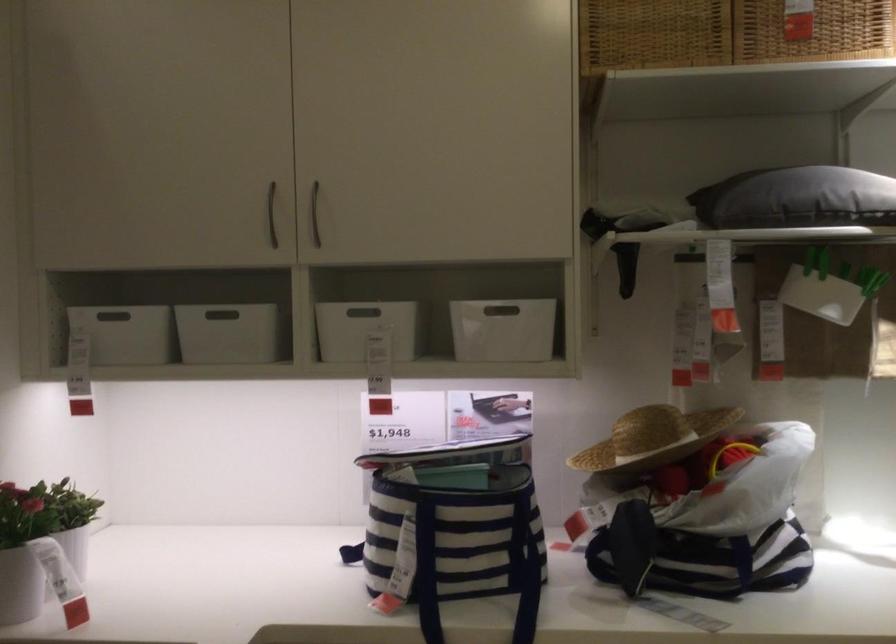
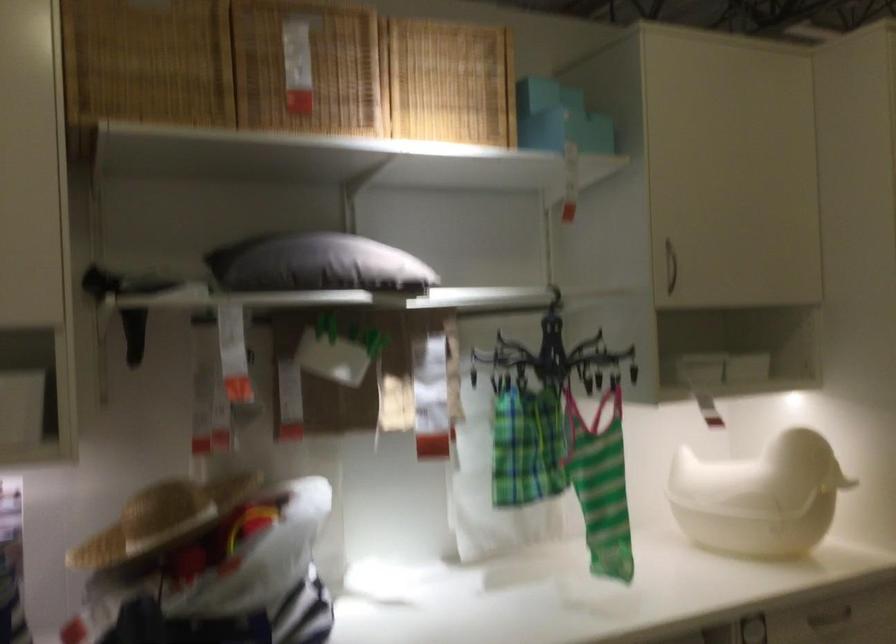
Find the pixel in the second image that matches point 810,193 in the first image.

(316, 263)